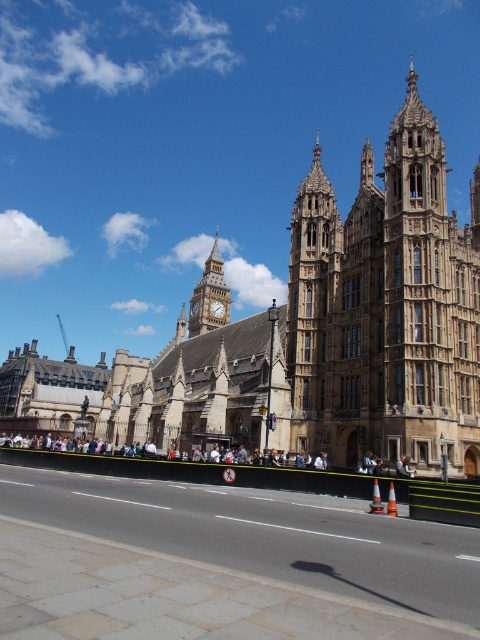
Find the location of a particular element. The image size is (480, 640). stone tower at upper right is located at coordinates (x=420, y=294).

The height and width of the screenshot is (640, 480). I want to click on stone tower at upper right, so click(x=420, y=294).

Which is above, stone tower at upper right or golden stone clock tower at center?

golden stone clock tower at center

Does point (435, 138) lie behind point (214, 292)?

No, (435, 138) is in front of (214, 292).

Between point (409, 204) and point (217, 266), which one is positioned behind?

Positioned behind is point (217, 266).

What are the coordinates of `stone tower at upper right` in the screenshot? It's located at (420, 294).

Does brown stone building at center appear on the right side of golden stone clock tower at center?

Correct, you'll find brown stone building at center to the right of golden stone clock tower at center.

Which is more to the right, brown stone building at center or golden stone clock tower at center?

Positioned to the right is brown stone building at center.

You are a GUI agent. You are given a task and a screenshot of the screen. Output one action in this format:
    pyautogui.click(x=<x>, y=<y>)
    Task: Click on the brown stone building at center
    
    Given the screenshot: What is the action you would take?
    pyautogui.click(x=314, y=333)